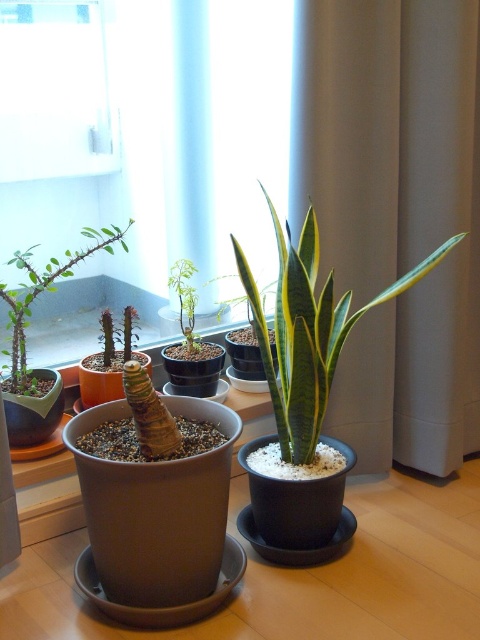
Question: Among these objects, which one is farthest from the camera?

Choices:
 (A) green matte leafy plant at center
 (B) green matte plant at center
 (C) green matte succulent at left

Answer: (B)

Question: Can you confirm if green matte leafy plant at center is positioned above green matte plant at center?

Choices:
 (A) no
 (B) yes

Answer: (A)

Question: Considering the real-world distances, which object is farthest from the green matte plant at center?

Choices:
 (A) green matte leafy plant at center
 (B) green matte succulent at left

Answer: (A)

Question: Does green matte leafy plant at center come behind green matte plant at center?

Choices:
 (A) no
 (B) yes

Answer: (A)

Question: Which of the following is the farthest from the observer?

Choices:
 (A) green matte leafy plant at center
 (B) green matte succulent at left
 (C) green matte plant at center

Answer: (C)

Question: Is green matte leafy plant at center closer to camera compared to green matte plant at center?

Choices:
 (A) yes
 (B) no

Answer: (A)